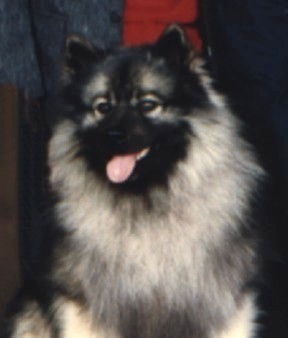
Locate an element on the screen. Image resolution: width=288 pixels, height=338 pixels. grey wall is located at coordinates (92, 17).